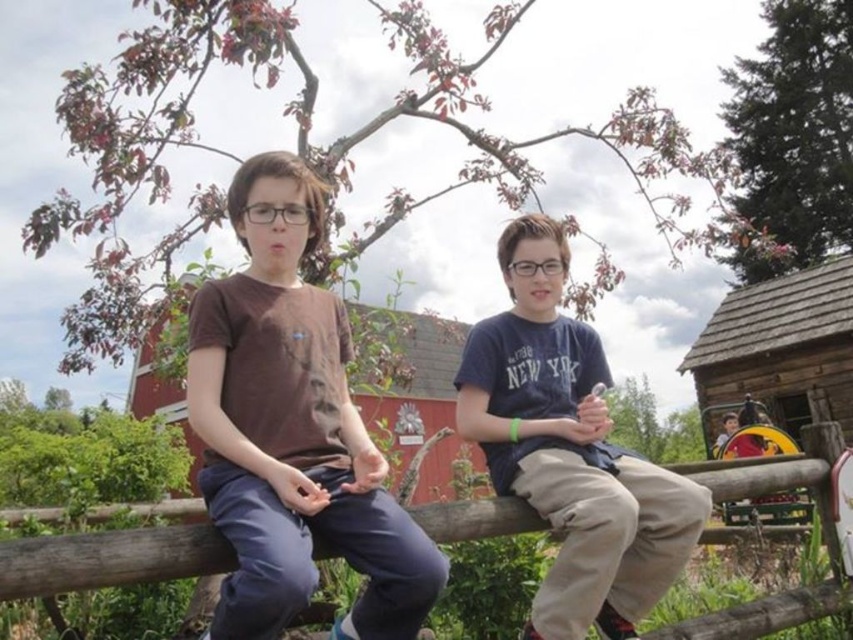
You are a photographer standing in front of the fence where the blue cotton shirt at center and wooden at center are located. You want to take a photo that includes both objects in the frame. Given that your camera has a minimum focus distance of 25 inches, will you be able to capture both objects clearly without moving closer?

The blue cotton shirt at center and wooden at center are 28.16 inches apart from each other. Since the distance between them is greater than the camera minimum focus distance of 25 inches, you can capture both objects clearly without moving closer.